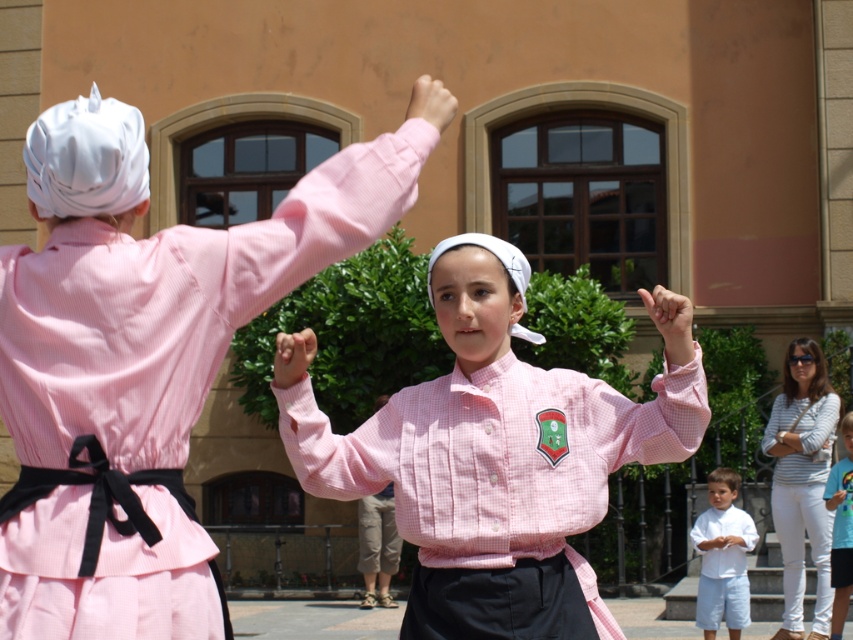
Does matte pink dress at back lie behind pink checkered shirt at center?

No, matte pink dress at back is closer to the viewer.

Which is below, matte pink dress at back or pink checkered shirt at center?

pink checkered shirt at center is below.

This screenshot has width=853, height=640. In order to click on matte pink dress at back in this screenshot , I will do `click(171, 305)`.

In the scene shown: Between pink checkered shirt at center and white striped shirt at upper right, which one is positioned lower?

white striped shirt at upper right is lower down.

Find the location of `pink checkered shirt at center`. pink checkered shirt at center is located at coordinates (495, 454).

The width and height of the screenshot is (853, 640). What do you see at coordinates (722, 556) in the screenshot?
I see `white cotton shirt at lower right` at bounding box center [722, 556].

Is point (720, 618) positioned in front of point (845, 529)?

That is False.

Is point (708, 604) more distant than point (843, 593)?

Yes.

In order to click on white cotton shirt at lower right in this screenshot , I will do `click(722, 556)`.